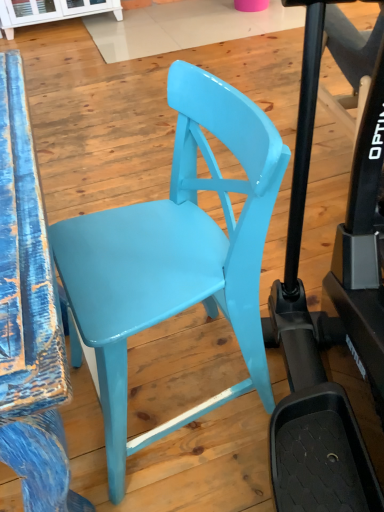
What is the approximate width of glossy plastic chair at center?

It is 45.66 centimeters.

Describe the element at coordinates (174, 257) in the screenshot. Image resolution: width=384 pixels, height=512 pixels. I see `glossy plastic chair at center` at that location.

This screenshot has width=384, height=512. What are the coordinates of `glossy plastic chair at center` in the screenshot? It's located at (174, 257).

Identify the location of glossy plastic chair at center. The height and width of the screenshot is (512, 384). (174, 257).